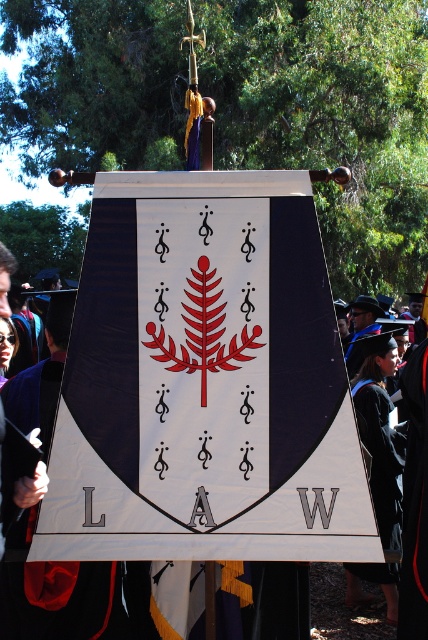
Question: Does black matte graduation robe at center appear over matte black graduation gown at center?

Choices:
 (A) yes
 (B) no

Answer: (B)

Question: Which of the following is the closest to the observer?

Choices:
 (A) (104, 576)
 (B) (418, 298)

Answer: (A)

Question: Can you confirm if white matte fabric at center is positioned above black matte graduation gown at lower right?

Choices:
 (A) yes
 (B) no

Answer: (A)

Question: Which point is closer to the camera?

Choices:
 (A) white matte fabric at center
 (B) black matte graduation gown at lower right
 (C) matte black graduation gown at center

Answer: (A)

Question: Among these points, which one is nearest to the camera?

Choices:
 (A) (392, 532)
 (B) (8, 540)
 (C) (178, 428)
 (D) (409, 333)

Answer: (C)

Question: Does black matte graduation gown at lower right have a smaller size compared to matte black graduation gown at center?

Choices:
 (A) no
 (B) yes

Answer: (B)